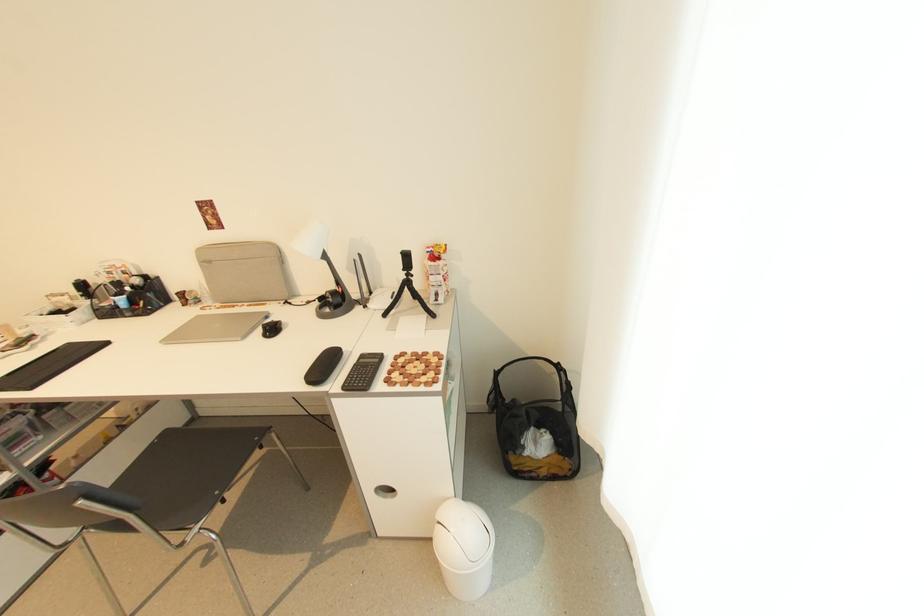
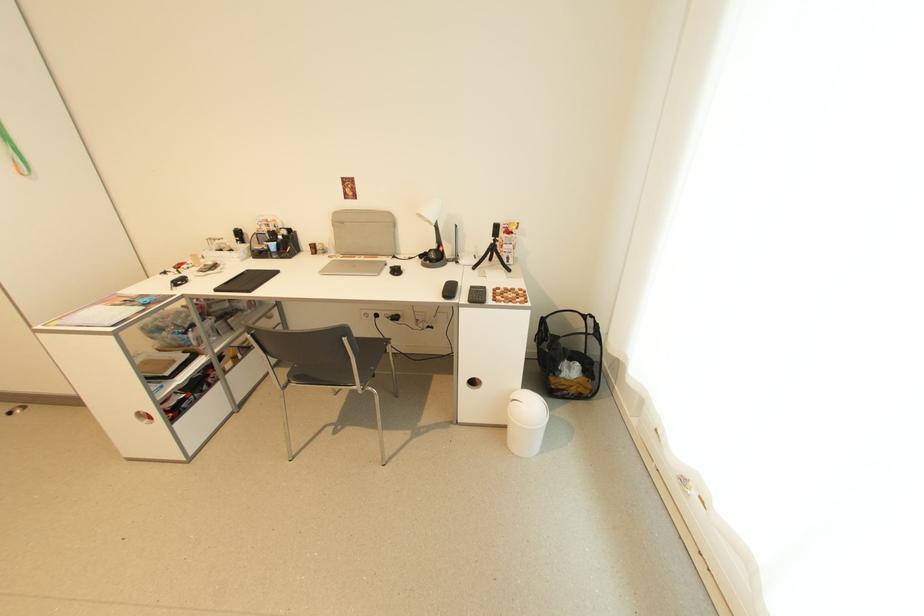
The point at (x=408, y=270) is marked in the first image. Where is the corresponding point in the second image?

(497, 238)